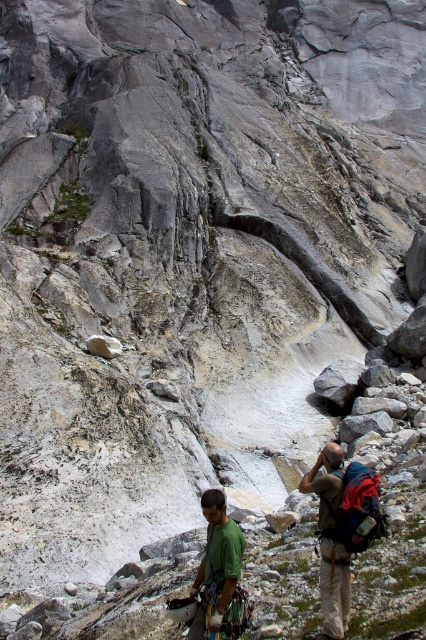
Question: Is green matte shirt at lower center above gray rough rock at center?

Choices:
 (A) no
 (B) yes

Answer: (A)

Question: Among these points, which one is farthest from the camera?

Choices:
 (A) (227, 637)
 (B) (112, 340)

Answer: (B)

Question: Among these objects, which one is farthest from the camera?

Choices:
 (A) gray rough rock at center
 (B) green matte shirt at lower center

Answer: (A)

Question: From the image, what is the correct spatial relationship of green matte shirt at lower center in relation to gray rough rock at center?

Choices:
 (A) left
 (B) right

Answer: (B)

Question: Which object is closer to the camera taking this photo?

Choices:
 (A) green matte shirt at lower center
 (B) gray rough rock at center

Answer: (A)

Question: Does green matte shirt at lower center have a greater width compared to gray rough rock at center?

Choices:
 (A) no
 (B) yes

Answer: (A)